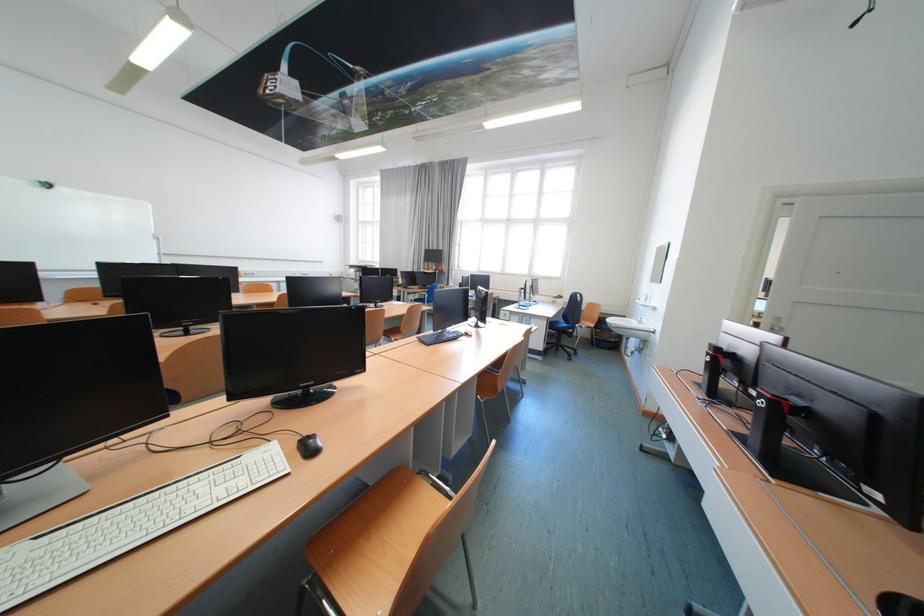
Find the location of `black computer keyboard`. black computer keyboard is located at coordinates (440, 336).